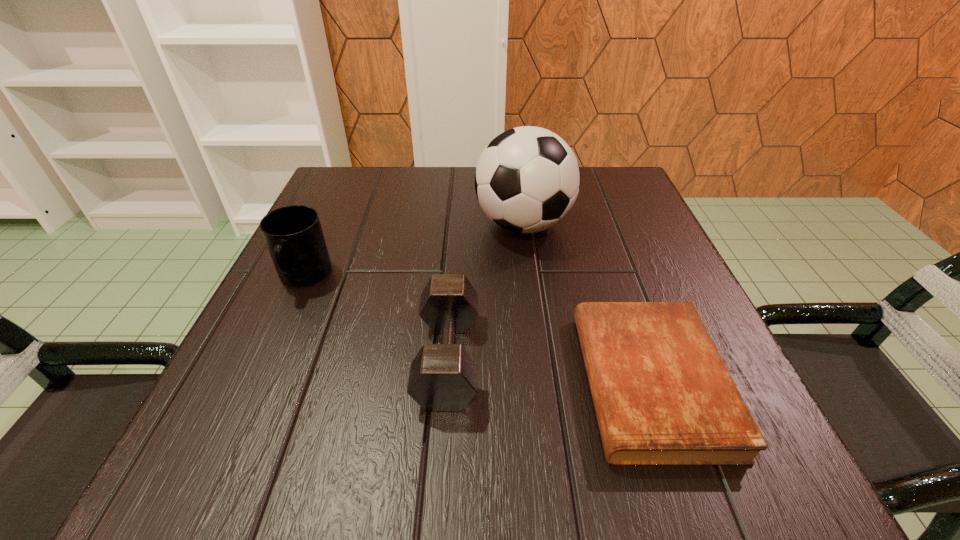
The width and height of the screenshot is (960, 540). I want to click on the farthest object, so click(527, 179).

At what (x,y) coordinates should I click in order to perform the action: click on the tallest object. Please return your answer as a coordinate pair (x, y). The width and height of the screenshot is (960, 540). Looking at the image, I should click on (527, 179).

Identify the location of the third shortest object. (293, 234).

Identify the location of mug. This screenshot has width=960, height=540. (293, 234).

Locate an element on the screen. This screenshot has width=960, height=540. dumbbell is located at coordinates (443, 377).

The image size is (960, 540). I want to click on Bible, so click(x=662, y=394).

Identify the location of free spot located 0.360m on the left of the tallest object. This screenshot has width=960, height=540. (306, 225).

At what (x,y) coordinates should I click in order to perform the action: click on free space located 0.290m on the side of the mug with the handle. Please return your answer as a coordinate pair (x, y). The image size is (960, 540). Looking at the image, I should click on tap(218, 462).

Where is `free space located 0.090m on the right of the dumbbell`? This screenshot has height=540, width=960. free space located 0.090m on the right of the dumbbell is located at coordinates (537, 357).

The height and width of the screenshot is (540, 960). Find the location of `free space located 0.200m on the spine side of the Bible`. free space located 0.200m on the spine side of the Bible is located at coordinates coord(447,382).